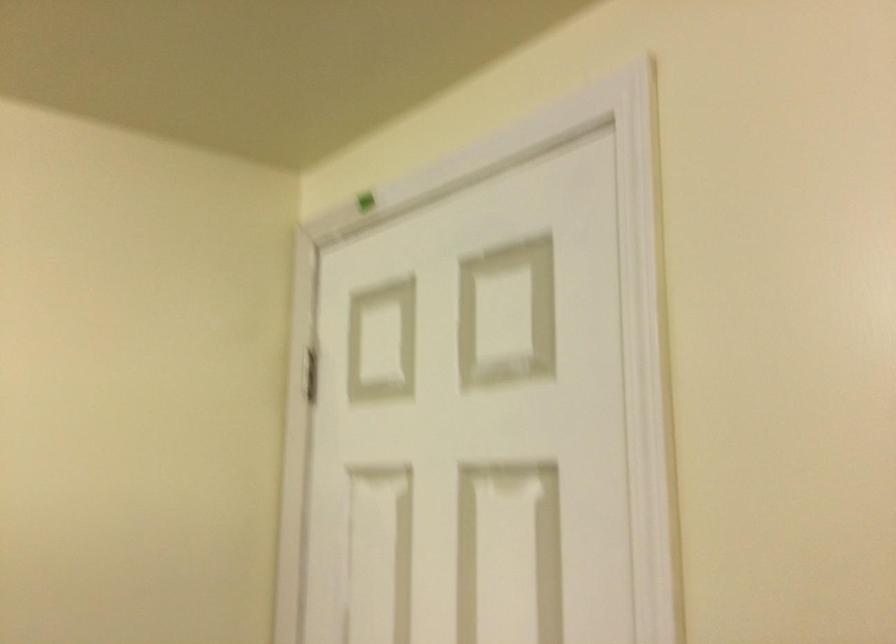
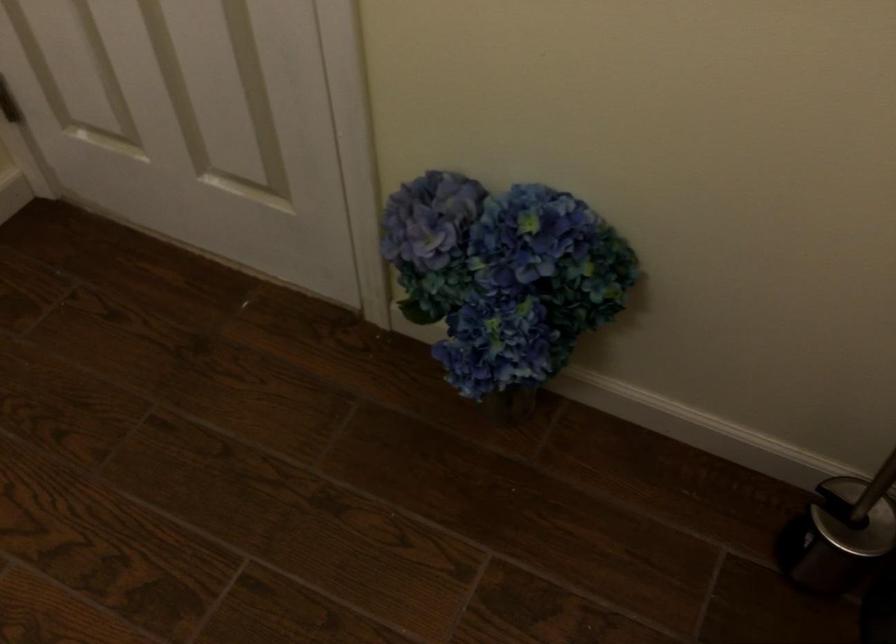
The first image is from the beginning of the video and the second image is from the end. How did the camera likely rotate when shooting the video?

The camera's rotation is toward right-down.